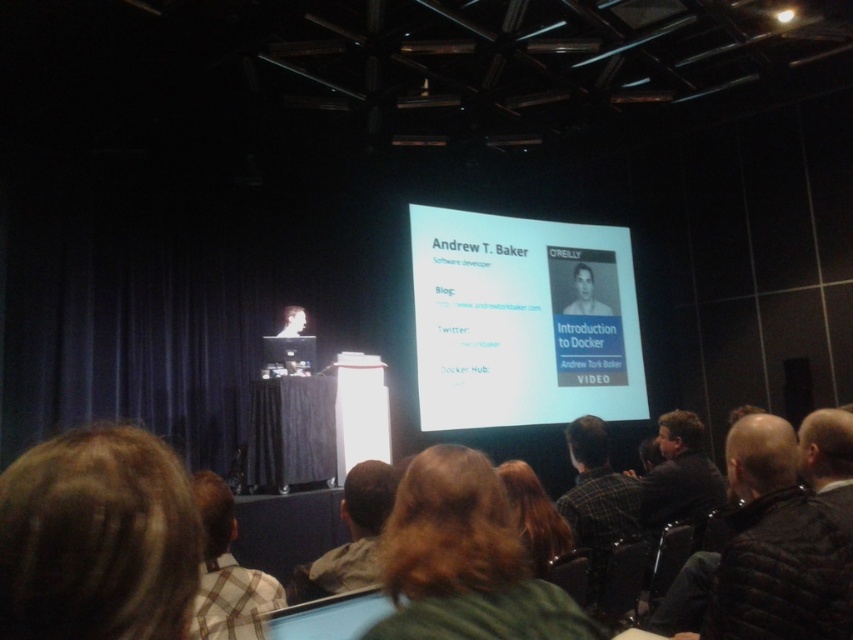
Question: Estimate the real-world distances between objects in this image. Which object is closer to the dark brown hair at lower right?

Choices:
 (A) dark brown hair at center
 (B) brown hair at lower center
 (C) brown hair at lower left

Answer: (A)

Question: Can you confirm if dark brown hair at center is positioned above dark brown hair at lower right?

Choices:
 (A) no
 (B) yes

Answer: (A)

Question: Where is dark brown leather jacket at lower right located in relation to dark brown hair at lower right in the image?

Choices:
 (A) below
 (B) above

Answer: (A)

Question: Estimate the real-world distances between objects in this image. Which object is closer to the dark brown leather jacket at lower right?

Choices:
 (A) brown hair at lower left
 (B) dark brown hair at center
 (C) dark brown hair at lower right
 (D) blonde hair at lower center

Answer: (D)

Question: Does dark brown hair at lower right appear on the left side of light blue shirt at upper center?

Choices:
 (A) no
 (B) yes

Answer: (B)

Question: Which object is the closest to the brown hair at lower center?

Choices:
 (A) white matte projector screen at center
 (B) dark brown leather jacket at lower right
 (C) brown hair at lower left

Answer: (C)